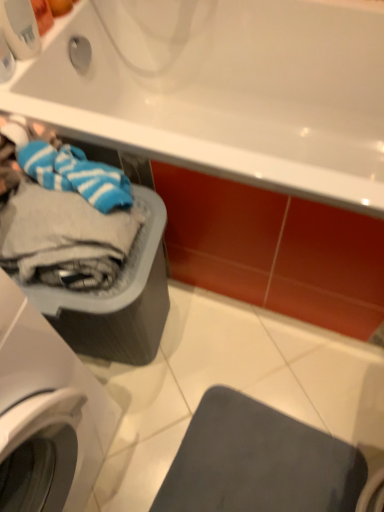
Identify the location of free space to the left of matte gray mat at lower right. The image size is (384, 512). (143, 439).